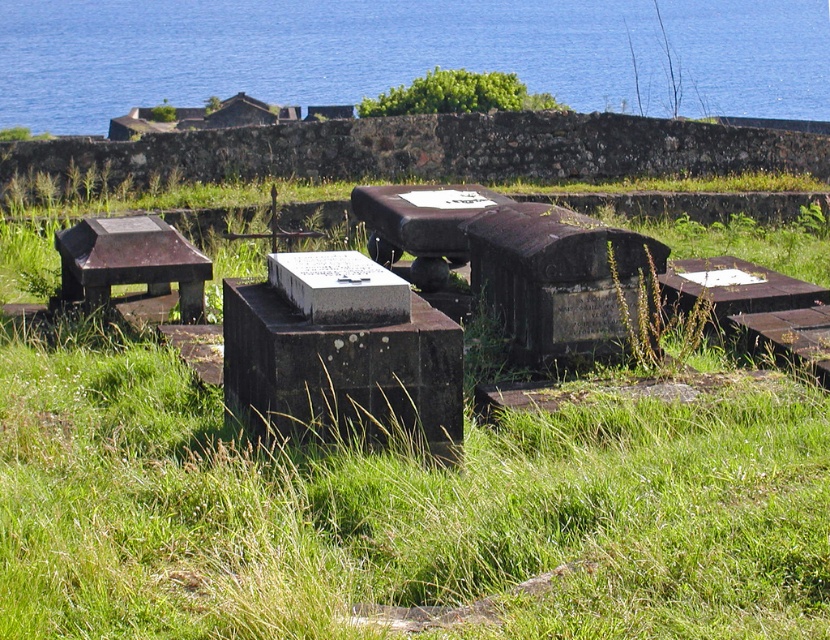
You are standing in the cemetery and want to sit down. There is a rustic wood bench at left and the blue water at upper center. Which one is closer to you?

The rustic wood bench at left is closer to you than the blue water at upper center because the blue water at upper center is further away in the background.

You are standing in the cemetery and want to take a seat. The blue water at upper center and the rustic wood bench at left are both in your view. Which one is closer to you?

The rustic wood bench at left is closer to you because the blue water at upper center is much taller, indicating it is further away.